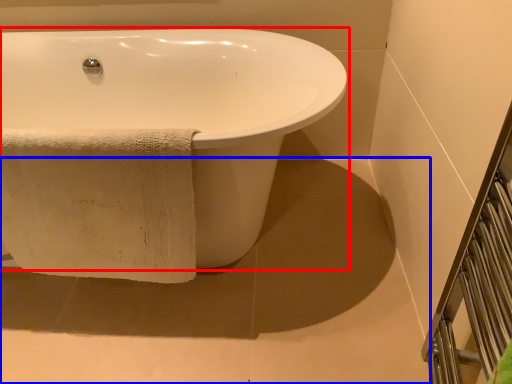
Question: Which point is closer to the camera, bathtub (highlighted by a red box) or concrete (highlighted by a blue box)?

Choices:
 (A) bathtub
 (B) concrete

Answer: (A)